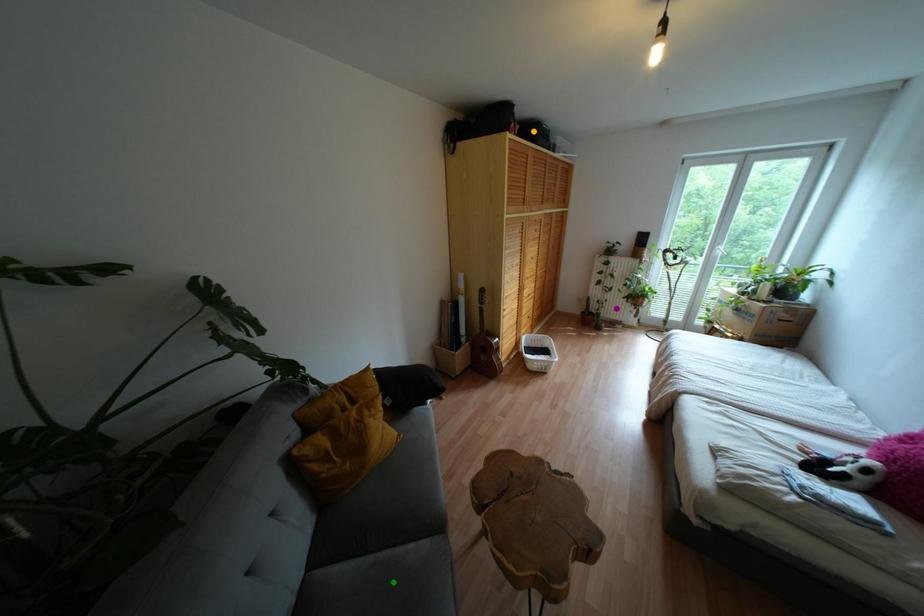
Order these from nearest to farthest:
1. purple point
2. green point
3. orange point

green point < orange point < purple point